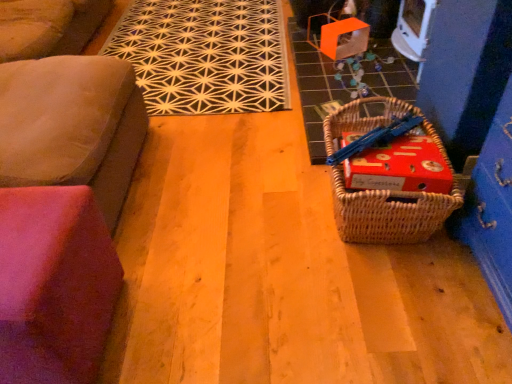
Question: Can you confirm if woven brown picnic basket at lower right is positioned to the left of pink fabric cushion at lower left, which is the first furniture from bottom to top?

Choices:
 (A) yes
 (B) no

Answer: (B)

Question: Would you say woven brown picnic basket at lower right is a long distance from pink fabric cushion at lower left, the second furniture from the top?

Choices:
 (A) no
 (B) yes

Answer: (A)

Question: Can you confirm if woven brown picnic basket at lower right is bigger than pink fabric cushion at lower left, the second furniture from the top?

Choices:
 (A) yes
 (B) no

Answer: (B)

Question: Can you confirm if woven brown picnic basket at lower right is smaller than pink fabric cushion at lower left, the second furniture from the top?

Choices:
 (A) yes
 (B) no

Answer: (A)

Question: From the image's perspective, would you say woven brown picnic basket at lower right is shown under pink fabric cushion at lower left, the second furniture from the top?

Choices:
 (A) yes
 (B) no

Answer: (B)

Question: Is pink fabric cushion at lower left, which is the first furniture from bottom to top, a part of woven brown picnic basket at lower right?

Choices:
 (A) yes
 (B) no

Answer: (B)

Question: From a real-world perspective, is woven brown picnic basket at lower right positioned over suede couch at left, which appears as the second furniture when ordered from the bottom, based on gravity?

Choices:
 (A) no
 (B) yes

Answer: (A)

Question: Does woven brown picnic basket at lower right touch suede couch at left, acting as the 1th furniture starting from the top?

Choices:
 (A) no
 (B) yes

Answer: (A)

Question: From the image's perspective, is woven brown picnic basket at lower right over suede couch at left, acting as the 1th furniture starting from the top?

Choices:
 (A) no
 (B) yes

Answer: (A)

Question: From the image's perspective, is woven brown picnic basket at lower right beneath suede couch at left, which appears as the second furniture when ordered from the bottom?

Choices:
 (A) yes
 (B) no

Answer: (A)

Question: Are woven brown picnic basket at lower right and suede couch at left, which appears as the second furniture when ordered from the bottom, far apart?

Choices:
 (A) no
 (B) yes

Answer: (A)

Question: Considering the relative sizes of woven brown picnic basket at lower right and suede couch at left, which appears as the second furniture when ordered from the bottom, in the image provided, is woven brown picnic basket at lower right wider than suede couch at left, which appears as the second furniture when ordered from the bottom,?

Choices:
 (A) no
 (B) yes

Answer: (A)

Question: Is black geometric rug at upper center not within woven brown picnic basket at lower right?

Choices:
 (A) yes
 (B) no

Answer: (A)